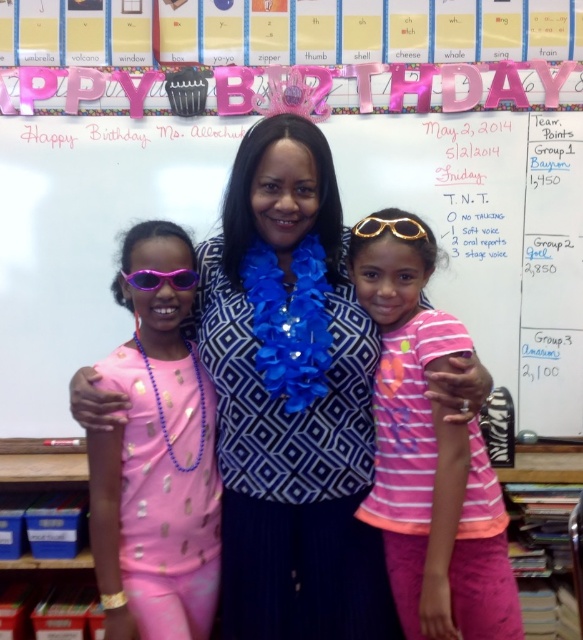
Is blue sequined lei at center positioned at the back of gold metallic goggles at center?

No, it is in front of gold metallic goggles at center.

Which is behind, point (340, 577) or point (398, 216)?

Positioned behind is point (398, 216).

Where is `blue sequined lei at center`? blue sequined lei at center is located at coordinates (290, 401).

Is point (79, 182) closer to camera compared to point (223, 548)?

That is False.

Who is more forward, (43, 342) or (269, 556)?

Point (269, 556) is more forward.

Which is in front, point (529, 212) or point (231, 557)?

Positioned in front is point (231, 557).

Locate an element on the screen. This screenshot has width=583, height=640. pink paper banner at upper center is located at coordinates (489, 230).

Does blue sequined lei at center appear over purple shiny goggles at left?

No.

Identify the location of blue sequined lei at center. The height and width of the screenshot is (640, 583). (290, 401).